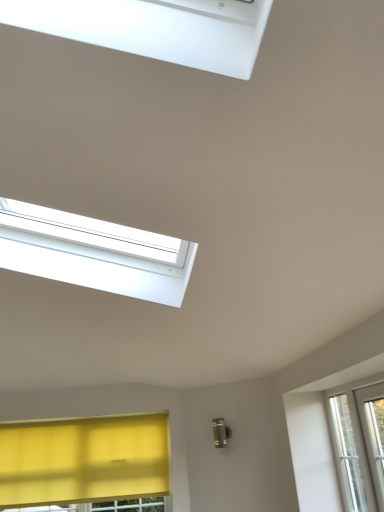
Measure the distance between point (377, 390) and camera.

They are 7.81 feet apart.

What do you see at coordinates (352, 454) in the screenshot?
I see `clear glass window at lower right` at bounding box center [352, 454].

Identify the location of clear glass window at lower right. The image size is (384, 512). (352, 454).

The image size is (384, 512). In order to click on clear glass window at lower right in this screenshot , I will do pyautogui.click(x=352, y=454).